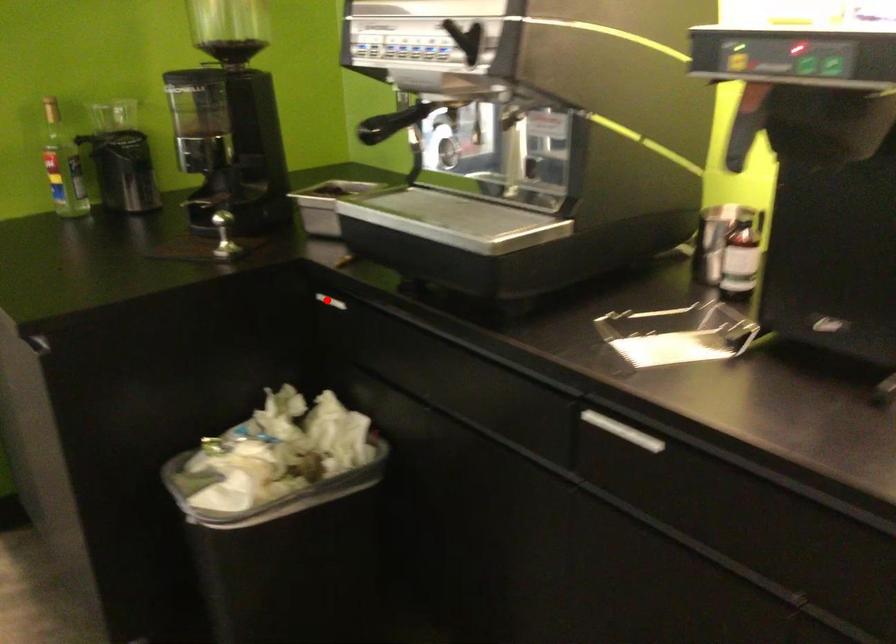
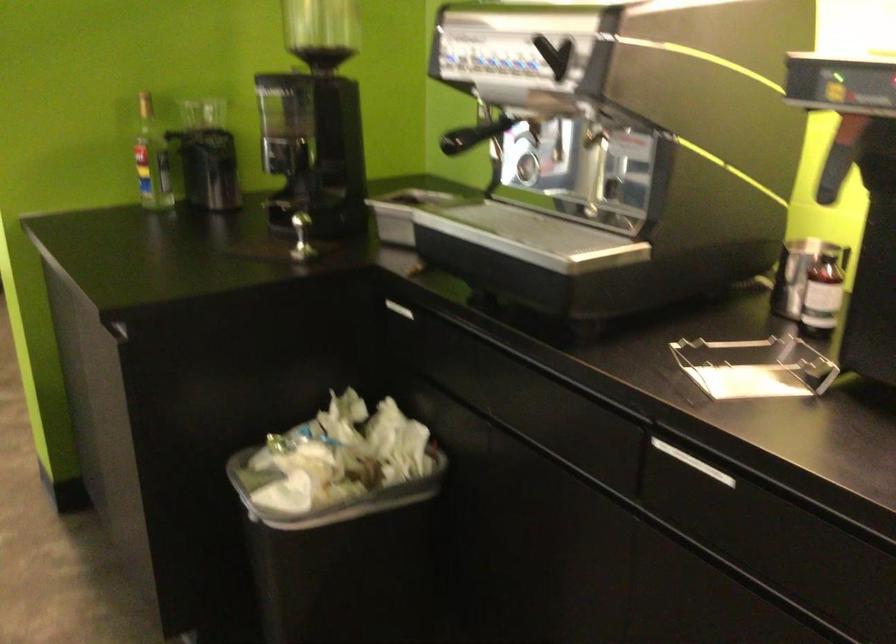
In the second image, find the point that corresponds to the highlighted location in the first image.

(394, 308)